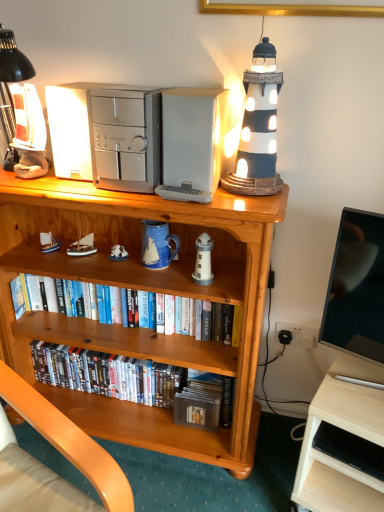
Question: Which direction should I rotate to look at white matte lighthouse at center, which is counted as the 1th toy, starting from the front?

Choices:
 (A) right
 (B) left

Answer: (A)

Question: Is satin silver computer tower at upper center, placed as the 2th appliance when sorted from left to right, thinner than white plastic microwave at upper center, the third appliance when ordered from left to right?

Choices:
 (A) yes
 (B) no

Answer: (A)

Question: Can you confirm if satin silver computer tower at upper center, the second appliance in the right-to-left sequence, is wider than white plastic microwave at upper center, the third appliance when ordered from left to right?

Choices:
 (A) yes
 (B) no

Answer: (B)

Question: Is satin silver computer tower at upper center, placed as the 2th appliance when sorted from left to right, facing away from white plastic microwave at upper center, which is the 1th appliance from right to left?

Choices:
 (A) no
 (B) yes

Answer: (A)

Question: From a real-world perspective, is satin silver computer tower at upper center, the second appliance in the right-to-left sequence, physically above white plastic microwave at upper center, which is the 1th appliance from right to left?

Choices:
 (A) yes
 (B) no

Answer: (A)

Question: Is the depth of satin silver computer tower at upper center, placed as the 2th appliance when sorted from left to right, greater than that of white plastic microwave at upper center, the third appliance when ordered from left to right?

Choices:
 (A) yes
 (B) no

Answer: (B)

Question: Is satin silver computer tower at upper center, the second appliance in the right-to-left sequence, facing towards white plastic microwave at upper center, the third appliance when ordered from left to right?

Choices:
 (A) yes
 (B) no

Answer: (B)

Question: Is white wood desk at lower right further to camera compared to white plastic microwave at upper center, the third appliance when ordered from left to right?

Choices:
 (A) yes
 (B) no

Answer: (B)

Question: Can you confirm if white wood desk at lower right is bigger than white plastic microwave at upper center, which is the 1th appliance from right to left?

Choices:
 (A) yes
 (B) no

Answer: (A)

Question: Is white wood desk at lower right oriented towards white plastic microwave at upper center, which is the 1th appliance from right to left?

Choices:
 (A) no
 (B) yes

Answer: (A)

Question: From a real-world perspective, does white wood desk at lower right stand above white plastic microwave at upper center, the third appliance when ordered from left to right?

Choices:
 (A) no
 (B) yes

Answer: (A)

Question: Considering the relative sizes of white wood desk at lower right and white plastic microwave at upper center, the third appliance when ordered from left to right, in the image provided, is white wood desk at lower right wider than white plastic microwave at upper center, the third appliance when ordered from left to right,?

Choices:
 (A) no
 (B) yes

Answer: (B)

Question: Can you confirm if white wood desk at lower right is thinner than white plastic microwave at upper center, which is the 1th appliance from right to left?

Choices:
 (A) no
 (B) yes

Answer: (A)

Question: From the image's perspective, is matte black lighthouse at upper right on wooden bookcase at center?

Choices:
 (A) yes
 (B) no

Answer: (A)